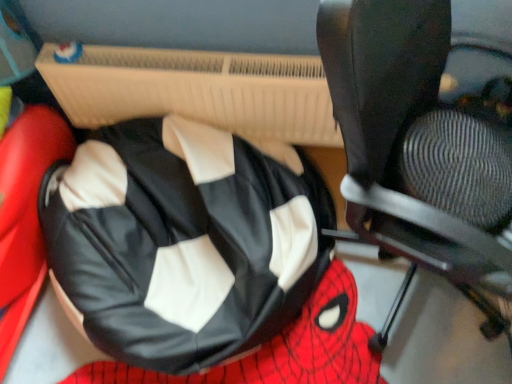
Question: Do you think black leather bean bag at center is within black leather chair at center, or outside of it?

Choices:
 (A) inside
 (B) outside

Answer: (B)

Question: From their relative heights in the image, would you say black leather bean bag at center is taller or shorter than black leather chair at center?

Choices:
 (A) short
 (B) tall

Answer: (A)

Question: Based on their positions, is black leather bean bag at center located to the left or right of black leather chair at center?

Choices:
 (A) left
 (B) right

Answer: (A)

Question: From a real-world perspective, is black leather chair at center positioned above or below black leather bean bag at center?

Choices:
 (A) below
 (B) above

Answer: (B)

Question: Is black leather chair at center inside the boundaries of black leather bean bag at center, or outside?

Choices:
 (A) outside
 (B) inside

Answer: (A)

Question: Considering the positions of black leather chair at center and black leather bean bag at center in the image, is black leather chair at center bigger or smaller than black leather bean bag at center?

Choices:
 (A) big
 (B) small

Answer: (A)

Question: From the image's perspective, relative to black leather bean bag at center, is black leather chair at center above or below?

Choices:
 (A) below
 (B) above

Answer: (B)